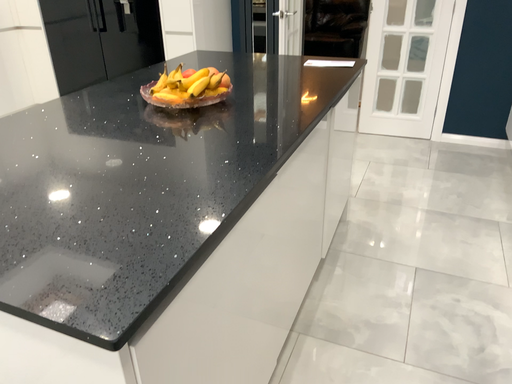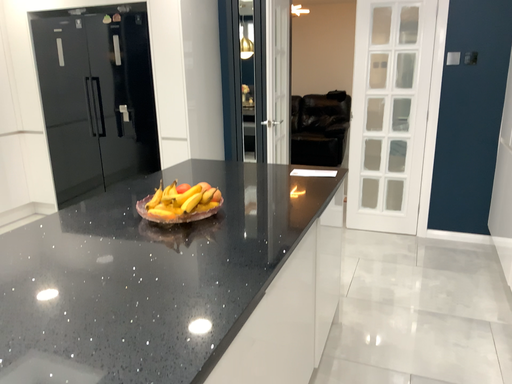
Question: How did the camera likely rotate when shooting the video?

Choices:
 (A) rotated downward
 (B) rotated upward

Answer: (B)